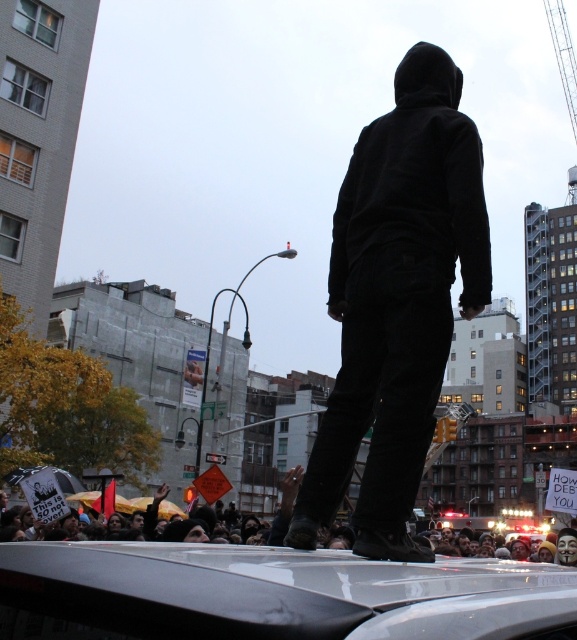
You are a photographer trying to capture the protest scene. You notice the silver metallic car at center and the black velvety hoodie at upper center. Which object is wider in the image?

The silver metallic car at center is wider than the black velvety hoodie at upper center according to the description.

You are a photographer trying to capture both the black matte hoodie at center and the black velvety hoodie at upper center in a single frame. Based on their positions and sizes, which one would appear larger in your photo?

The black matte hoodie at center would appear larger in the photo because it might be wider than the black velvety hoodie at upper center.